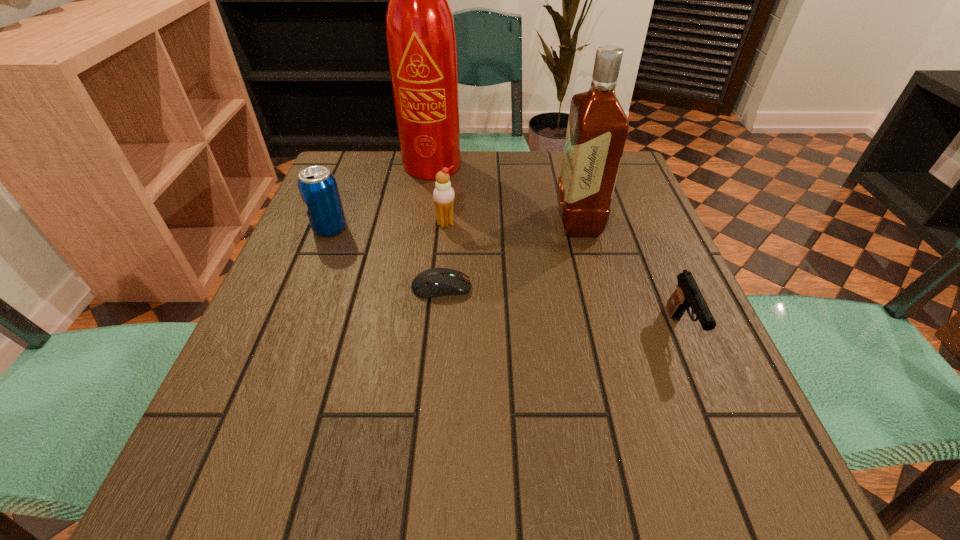
Identify the location of free space located 0.310m on the front of the fire extinguisher. The image size is (960, 540). (423, 258).

Where is `vacant space situated on the front label of the liquor`? vacant space situated on the front label of the liquor is located at coordinates (491, 221).

I want to click on vacant area situated 0.220m on the front label of the liquor, so click(466, 221).

Find the location of a particular element. Image resolution: width=960 pixels, height=540 pixels. vacant region located on the front label of the liquor is located at coordinates (407, 221).

This screenshot has width=960, height=540. What are the coordinates of `free point located at the front with a straw on the icecream` in the screenshot? It's located at pyautogui.click(x=439, y=294).

Identify the location of vacant space located 0.220m on the front of the pop soda. (297, 312).

The height and width of the screenshot is (540, 960). In order to click on vacant position located at the barrel of the pistol in this screenshot , I will do `click(712, 407)`.

Locate an element on the screen. The height and width of the screenshot is (540, 960). vacant point located 0.380m on the button of the computer equipment is located at coordinates (659, 287).

This screenshot has height=540, width=960. Identify the location of object located at the far edge. (421, 40).

The width and height of the screenshot is (960, 540). I want to click on object situated at the left edge, so click(317, 185).